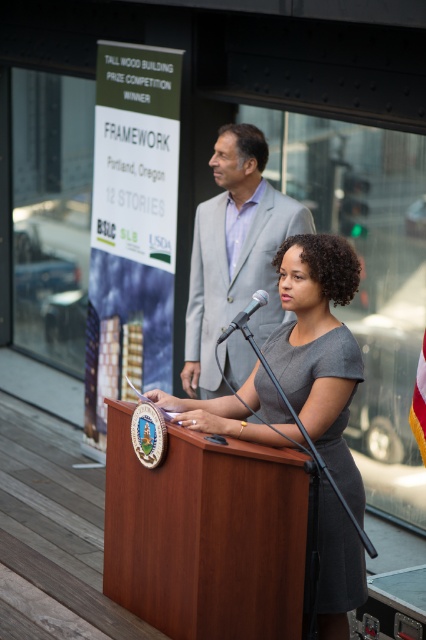
Does gray matte dress at center have a larger size compared to metallic silver microphone at center?

Yes.

Is gray matte dress at center shorter than metallic silver microphone at center?

No.

Image resolution: width=426 pixels, height=640 pixels. In order to click on gray matte dress at center in this screenshot , I will do `click(319, 348)`.

Locate an element on the screen. The image size is (426, 640). gray matte dress at center is located at coordinates (319, 348).

Does gray suit at upper center lie behind metallic silver microphone at center?

Yes.

Is point (261, 132) behind point (264, 294)?

Yes, point (261, 132) is farther from viewer.

Is point (218, 216) positioned after point (221, 337)?

Yes, it is.

I want to click on gray suit at upper center, so click(x=235, y=252).

The image size is (426, 640). In order to click on mahogany wood podium at center in this screenshot , I will do pos(206,534).

Is mahogany wood podium at center smaller than metallic silver microphone at center?

No, mahogany wood podium at center is not smaller than metallic silver microphone at center.

Locate an element on the screen. The image size is (426, 640). mahogany wood podium at center is located at coordinates (206, 534).